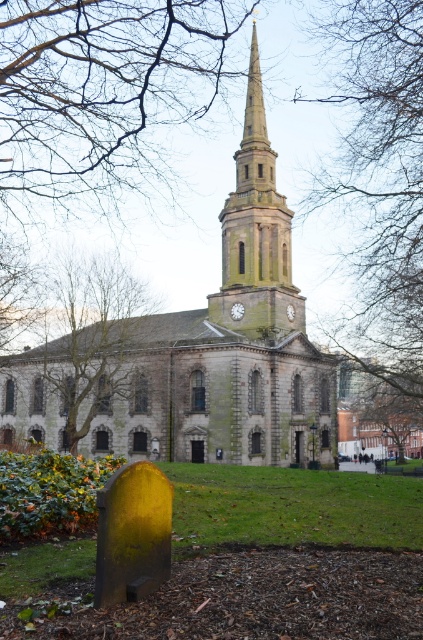
In the scene shown: You are standing in front of the historic stone church and notice a point marked at coordinates [381,188]. Based on the scene description, what object or feature is located at this coordinate?

The point at coordinates [381,188] corresponds to the bare branches at upper center of the church image.

Consider the image. You are standing in front of the historic stone church and looking at the scene. Where exactly is the bare branches at upper center located in the image?

The bare branches at upper center are located at point (381, 188) in the image.